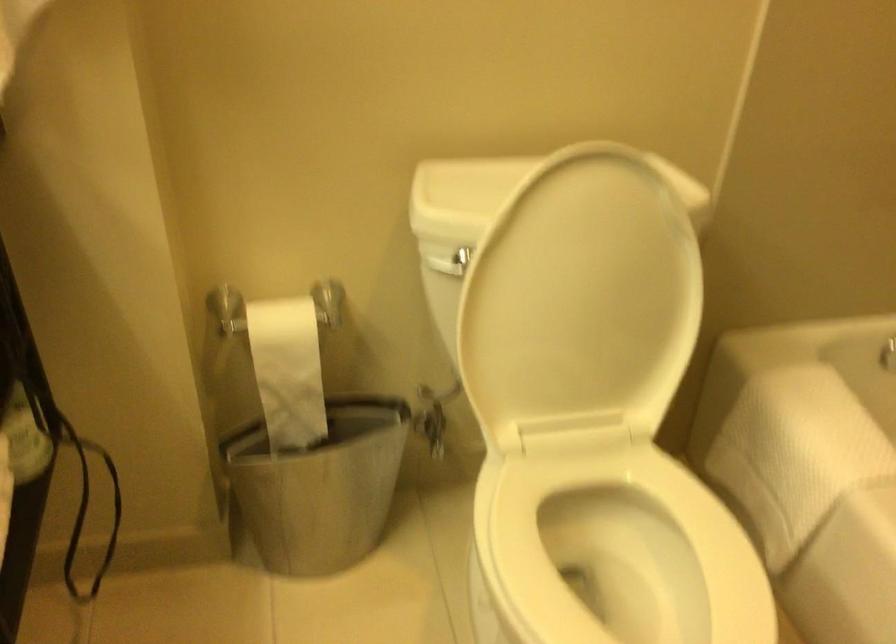
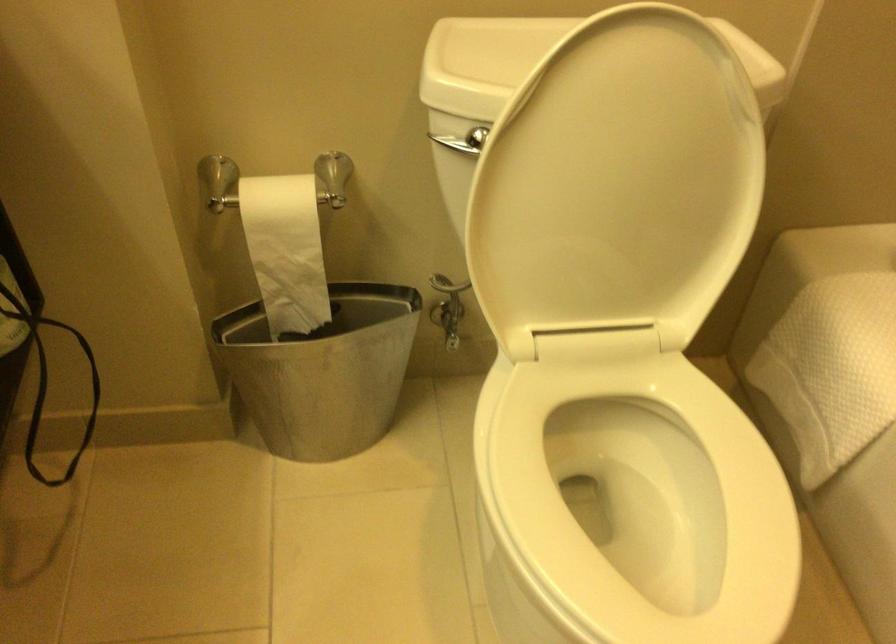
Where in the second image is the point corresponding to point 434,436 from the first image?

(449, 325)